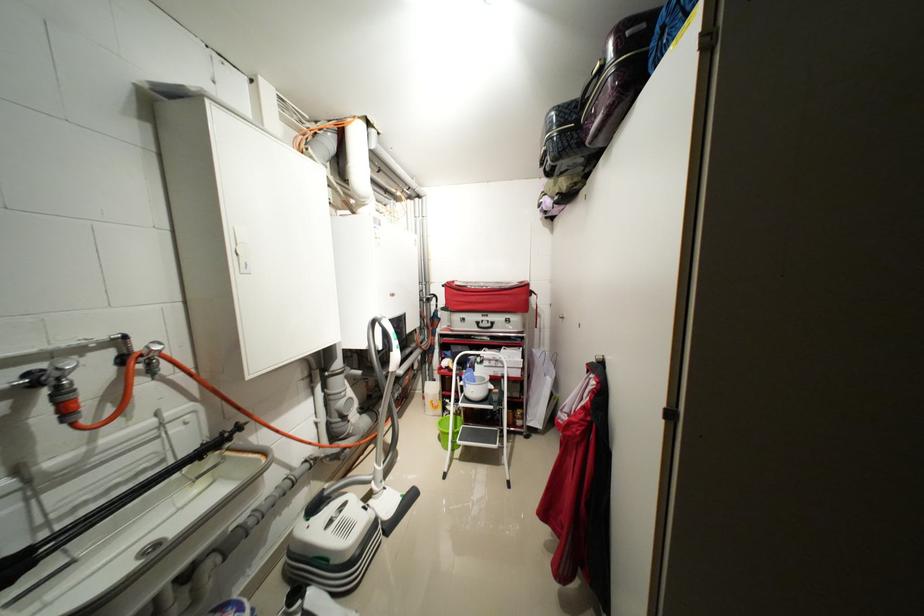
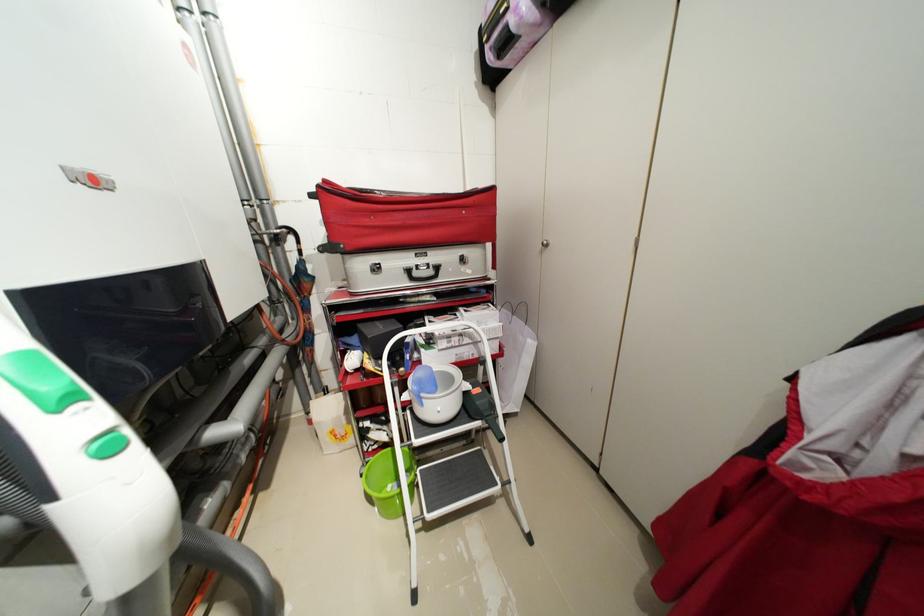
Where in the second image is the point corresponding to (x=455, y=284) from the first image?

(332, 182)